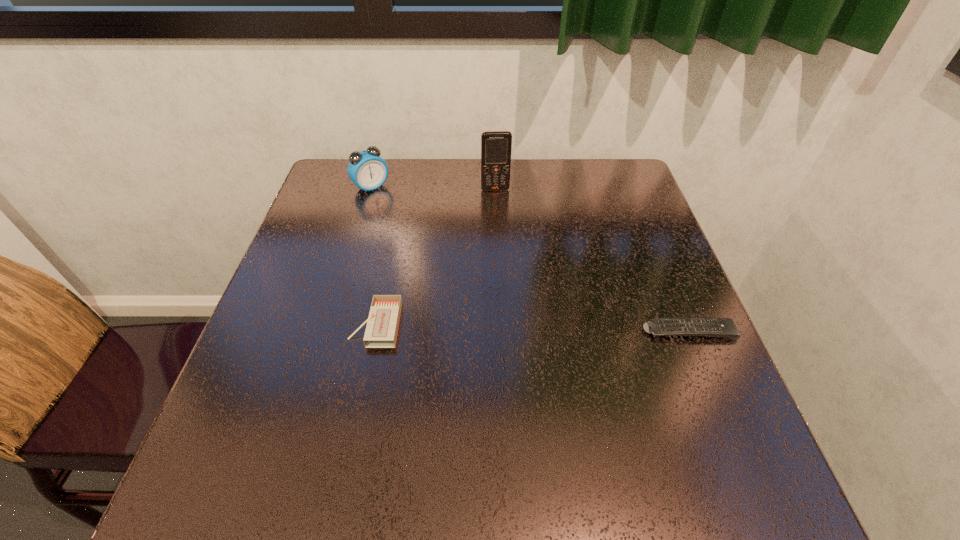
At what (x,y) coordinates should I click in order to perform the action: click on matchbox. Please return your answer as a coordinate pair (x, y). Looking at the image, I should click on (381, 331).

The height and width of the screenshot is (540, 960). In order to click on remote control in this screenshot , I will do `click(722, 327)`.

Where is `the rightmost object`? The width and height of the screenshot is (960, 540). the rightmost object is located at coordinates (722, 327).

You are a GUI agent. You are given a task and a screenshot of the screen. Output one action in this format:
    pyautogui.click(x=<x>, y=<y>)
    Task: Click on the tallest object
    This screenshot has height=540, width=960.
    Given the screenshot: What is the action you would take?
    pyautogui.click(x=496, y=146)

The height and width of the screenshot is (540, 960). I want to click on cellular telephone, so click(x=496, y=146).

This screenshot has height=540, width=960. I want to click on alarm clock, so click(x=368, y=171).

This screenshot has height=540, width=960. What are the coordinates of `vacant space located 0.130m on the striking surface of the matchbox` in the screenshot? It's located at (289, 324).

Find the location of `free space located 0.080m on the striking surface of the matchbox`. free space located 0.080m on the striking surface of the matchbox is located at coordinates (313, 324).

Where is `vacant area situated on the striking surface of the matchbox`? The height and width of the screenshot is (540, 960). vacant area situated on the striking surface of the matchbox is located at coordinates (269, 324).

Locate an element on the screen. The image size is (960, 540). free point located 0.180m on the left of the rightmost object is located at coordinates tap(554, 332).